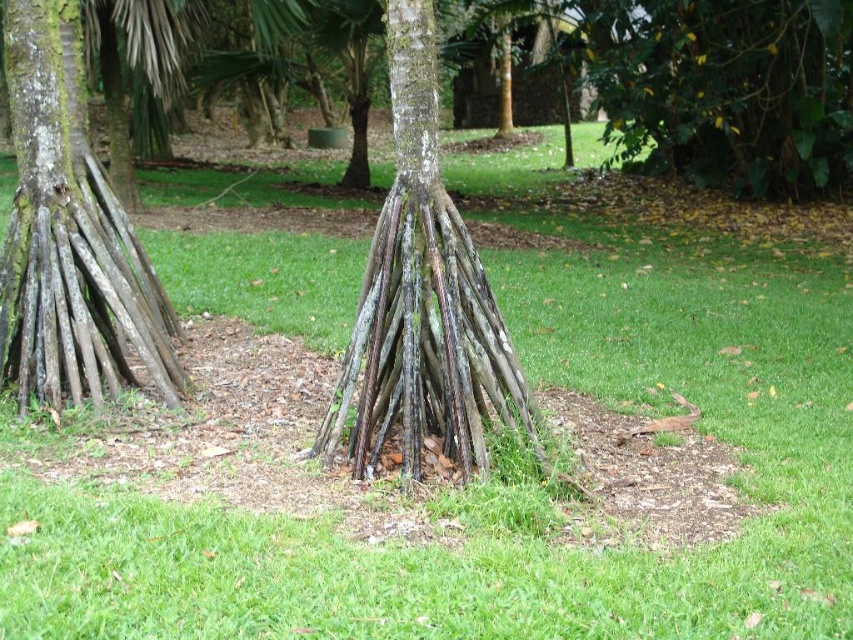
Does smooth brown wood at left have a smaller size compared to brown rough textured roots at center?

Incorrect, smooth brown wood at left is not smaller in size than brown rough textured roots at center.

Between point (39, 112) and point (364, 320), which one is positioned in front?

Positioned in front is point (364, 320).

Who is more distant from viewer, [22,72] or [471,320]?

The point [22,72] is behind.

This screenshot has width=853, height=640. I want to click on smooth brown wood at left, so click(x=70, y=236).